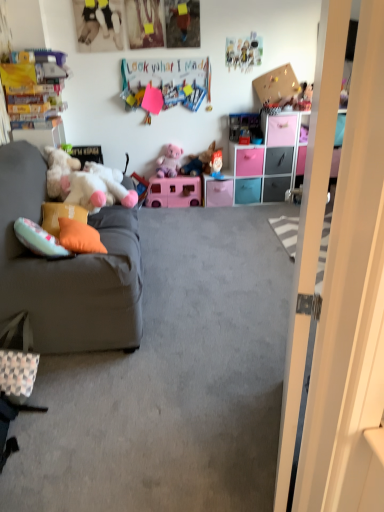
This screenshot has height=512, width=384. Find the location of `empty space that is in between velvet gray couch at left and white glossy door at right`. empty space that is in between velvet gray couch at left and white glossy door at right is located at coordinates (174, 370).